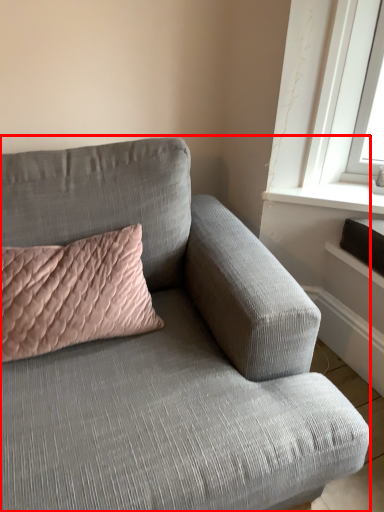
Question: From the image, what is the correct spatial relationship of studio couch (annotated by the red box) in relation to pillow?

Choices:
 (A) left
 (B) right

Answer: (B)